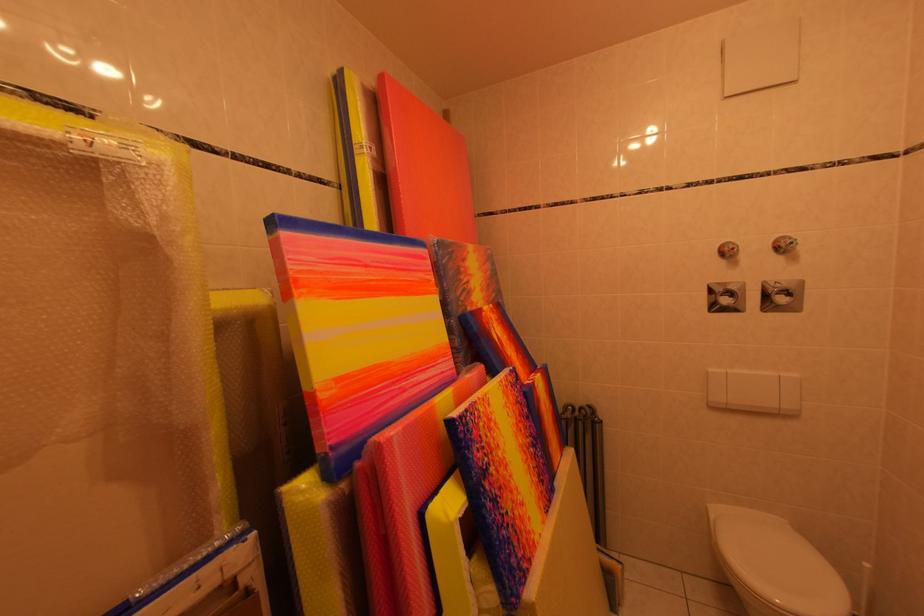
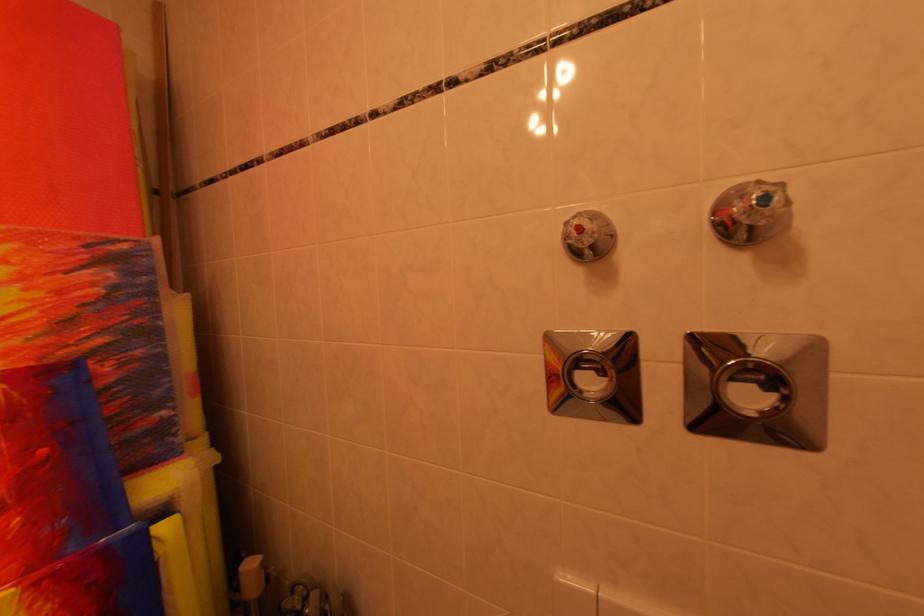
Find the pixel in the second image that matches (799,246) in the first image.

(773, 201)